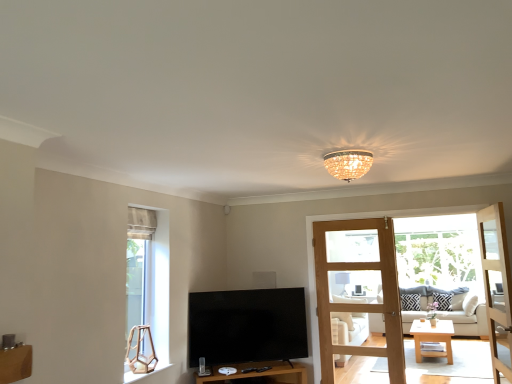
The height and width of the screenshot is (384, 512). Describe the element at coordinates (443, 300) in the screenshot. I see `black and white zigzag pillow at center, the first pillow from the right` at that location.

This screenshot has height=384, width=512. Identify the location of white sheer curtain at upper left. (141, 223).

What is the approximate height of white fabric studio couch at center?

white fabric studio couch at center is 35.88 inches tall.

Measure the distance between point (421,312) and camera.

They are 16.49 feet apart.

In the scene shown: Measure the distance between point (403, 294) and camera.

Point (403, 294) and camera are 17.08 feet apart.

Where is `black and white zigzag pillow at center, the first pillow from the right`? The width and height of the screenshot is (512, 384). black and white zigzag pillow at center, the first pillow from the right is located at coordinates (443, 300).

The height and width of the screenshot is (384, 512). In order to click on television in front of the light brown wooden door at center, placed as the first door when sorted from left to right in this screenshot , I will do `click(247, 326)`.

From the image's perspective, relative to black glossy tv at center, is light brown wooden door at center, which ranks as the 2th door in right-to-left order, above or below?

Clearly, from the image's perspective, light brown wooden door at center, which ranks as the 2th door in right-to-left order, is above black glossy tv at center.

Which is less distant, (393,306) or (211,298)?

Point (393,306).

Can you confirm if light brown wooden door at center, which ranks as the 2th door in right-to-left order, is shorter than black glossy tv at center?

No, light brown wooden door at center, which ranks as the 2th door in right-to-left order, is not shorter than black glossy tv at center.

Would you say white fabric studio couch at center contains matte black speaker at center?

That's incorrect, matte black speaker at center is not inside white fabric studio couch at center.

From the picture: Based on their sizes in the image, would you say white fabric studio couch at center is bigger or smaller than matte black speaker at center?

In the image, white fabric studio couch at center appears to be larger than matte black speaker at center.

Does white fabric studio couch at center lie in front of matte black speaker at center?

No.

What's the angular difference between white fabric studio couch at center and matte black speaker at center's facing directions?

0.000795 degrees separate the facing orientations of white fabric studio couch at center and matte black speaker at center.

Is light wood entertainment center at right smaller than beige fabric window at left?

Incorrect, light wood entertainment center at right is not smaller in size than beige fabric window at left.

Which of these two, light wood entertainment center at right or beige fabric window at left, stands shorter?

Standing shorter between the two is beige fabric window at left.

From the image's perspective, who appears lower, light wood entertainment center at right or beige fabric window at left?

light wood entertainment center at right appears lower in the image.

Which is behind, point (502, 232) or point (141, 259)?

The point (502, 232) is farther.

Can we say beige fabric window at left lies outside white fabric studio couch at center?

Absolutely, beige fabric window at left is external to white fabric studio couch at center.

Is beige fabric window at left next to white fabric studio couch at center and touching it?

There is a gap between beige fabric window at left and white fabric studio couch at center.

Measure the distance between beige fabric window at left and white fabric studio couch at center.

A distance of 3.02 meters exists between beige fabric window at left and white fabric studio couch at center.

Find the location of a particular element. The width and height of the screenshot is (512, 384). window in front of the white fabric studio couch at center is located at coordinates (149, 277).

Are black glossy tv at center and light brown wooden door at center, which ranks as the first door in back-to-front order, far apart?

No.

Is light brown wooden door at center, which ranks as the 2th door in right-to-left order, completely or partially inside black glossy tv at center?

Definitely not — light brown wooden door at center, which ranks as the 2th door in right-to-left order, is not inside black glossy tv at center.

Does black glossy tv at center turn towards light brown wooden door at center, which is counted as the second door, starting from the front?

No, black glossy tv at center does not turn towards light brown wooden door at center, which is counted as the second door, starting from the front.

Between black glossy tv at center and light brown wooden door at center, which ranks as the first door in back-to-front order, which one has larger width?

black glossy tv at center.

Is crystalline glass chandelier at center taller than black and white zigzag pillow at right, the 2th pillow positioned from the right?

Incorrect, the height of crystalline glass chandelier at center is not larger of that of black and white zigzag pillow at right, the 2th pillow positioned from the right.

Is crystalline glass chandelier at center outside of black and white zigzag pillow at right, acting as the first pillow starting from the left?

Yes, crystalline glass chandelier at center is outside of black and white zigzag pillow at right, acting as the first pillow starting from the left.

Is crystalline glass chandelier at center to the right of black and white zigzag pillow at right, acting as the first pillow starting from the left, from the viewer's perspective?

No, crystalline glass chandelier at center is not to the right of black and white zigzag pillow at right, acting as the first pillow starting from the left.

Does point (339, 171) come farther from viewer compared to point (401, 296)?

No.

From the picture: Is light wood entertainment center at right bigger than light brown wooden door at right, the first door in the front-to-back sequence?

Yes, light wood entertainment center at right is bigger than light brown wooden door at right, the first door in the front-to-back sequence.

Is light wood entertainment center at right to the left of light brown wooden door at right, acting as the 2th door starting from the back, from the viewer's perspective?

A: Indeed, light wood entertainment center at right is positioned on the left side of light brown wooden door at right, acting as the 2th door starting from the back.

Is light wood entertainment center at right oriented away from light brown wooden door at right, the first door in the front-to-back sequence?

No.

Consider the image. Is light wood entertainment center at right in front of or behind light brown wooden door at right, the 1th door from the right, in the image?

Visually, light wood entertainment center at right is located behind light brown wooden door at right, the 1th door from the right.

The image size is (512, 384). What are the coordinates of `door behind the black glossy tv at center` in the screenshot? It's located at (361, 303).

This screenshot has height=384, width=512. Find the location of `loudspeaker above the white fabric studio couch at center (from the image's perspective)`. loudspeaker above the white fabric studio couch at center (from the image's perspective) is located at coordinates (264, 279).

Based on their spatial positions, is light brown wooden door at center, which is counted as the second door, starting from the front, or black glossy tv at center closer to matte black speaker at center?

black glossy tv at center.

Based on their spatial positions, is white fabric studio couch at center or black and white zigzag pillow at right, acting as the first pillow starting from the left, closer to white sheer curtain at upper left?

The object closer to white sheer curtain at upper left is black and white zigzag pillow at right, acting as the first pillow starting from the left.

When comparing their distances from light brown wooden door at center, which is counted as the second door, starting from the front, does black and white zigzag pillow at right, the 2th pillow positioned from the right, or matte black speaker at center seem further?

black and white zigzag pillow at right, the 2th pillow positioned from the right.

From the image, which object appears to be farther from wooden at center, white fabric studio couch at center or black glossy tv at center?

The object further to wooden at center is white fabric studio couch at center.

Looking at the image, which one is located further to white wood coffee table at center, black and white zigzag pillow at center, the first pillow from the right, or white fabric studio couch at center?

Among the two, black and white zigzag pillow at center, the first pillow from the right, is located further to white wood coffee table at center.

Considering their positions, is matte black speaker at center positioned further to light wood entertainment center at right than white wood coffee table at center?

matte black speaker at center lies further to light wood entertainment center at right than the other object.

When comparing their distances from white sheer curtain at upper left, does black and white zigzag pillow at right, the 2th pillow positioned from the right, or black and white zigzag pillow at center, the first pillow from the right, seem further?

The object further to white sheer curtain at upper left is black and white zigzag pillow at center, the first pillow from the right.

Estimate the real-world distances between objects in this image. Which object is closer to crystalline glass chandelier at center, white fabric studio couch at center or white sheer curtain at upper left?

white sheer curtain at upper left is closer to crystalline glass chandelier at center.

Where is `door between light brown wooden door at right, acting as the 2th door starting from the back, and black and white zigzag pillow at right, the 2th pillow positioned from the right, along the z-axis`? This screenshot has height=384, width=512. door between light brown wooden door at right, acting as the 2th door starting from the back, and black and white zigzag pillow at right, the 2th pillow positioned from the right, along the z-axis is located at coordinates (361, 303).

I want to click on door between wooden at center and black and white zigzag pillow at right, the 2th pillow positioned from the right, in the front-back direction, so click(x=361, y=303).

You are a GUI agent. You are given a task and a screenshot of the screen. Output one action in this format:
    pyautogui.click(x=<x>, y=<y>)
    Task: Click on the curtain between beige fabric window at left and white wood coffee table at center in the horizontal direction
    
    Given the screenshot: What is the action you would take?
    pyautogui.click(x=141, y=223)

Locate an element on the screen. Image resolution: width=512 pixels, height=384 pixels. curtain located between beige fabric window at left and light brown wooden door at center, which ranks as the first door in back-to-front order, in the left-right direction is located at coordinates (141, 223).